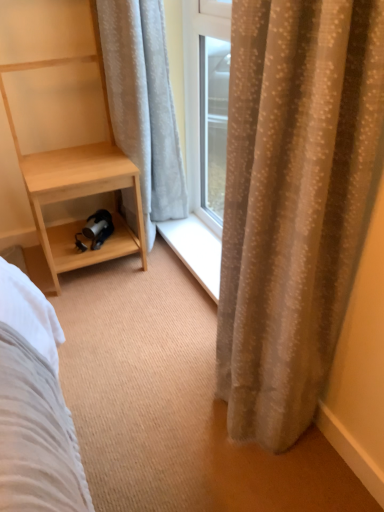
Question: Is light wood/texture shelf at left wider or thinner than white textured curtain at left, acting as the 2th curtain starting from the front?

Choices:
 (A) thin
 (B) wide

Answer: (B)

Question: Do you think light wood/texture shelf at left is within white textured curtain at left, acting as the 2th curtain starting from the front, or outside of it?

Choices:
 (A) inside
 (B) outside

Answer: (B)

Question: Which object is positioned farthest from the beige textured curtain at right, positioned as the 1th curtain in right-to-left order?

Choices:
 (A) white textured curtain at left, the 1th curtain when ordered from left to right
 (B) light wood/texture shelf at left

Answer: (B)

Question: Estimate the real-world distances between objects in this image. Which object is farther from the white textured curtain at left, marked as the first curtain in a back-to-front arrangement?

Choices:
 (A) light wood/texture shelf at left
 (B) beige textured curtain at right, positioned as the 1th curtain in front-to-back order

Answer: (B)